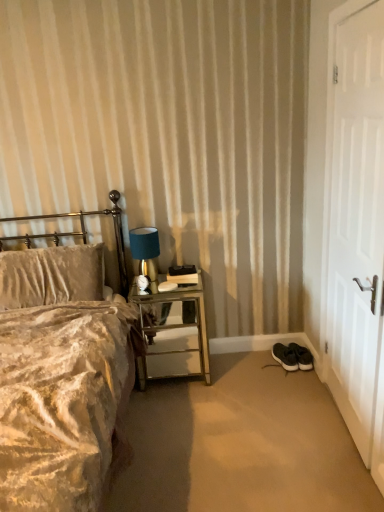
Where is `empty space that is in between mirrored glass nightstand at center and black suede sneakers at lower right, placed as the 1th footwear when sorted from right to left`? empty space that is in between mirrored glass nightstand at center and black suede sneakers at lower right, placed as the 1th footwear when sorted from right to left is located at coordinates (246, 368).